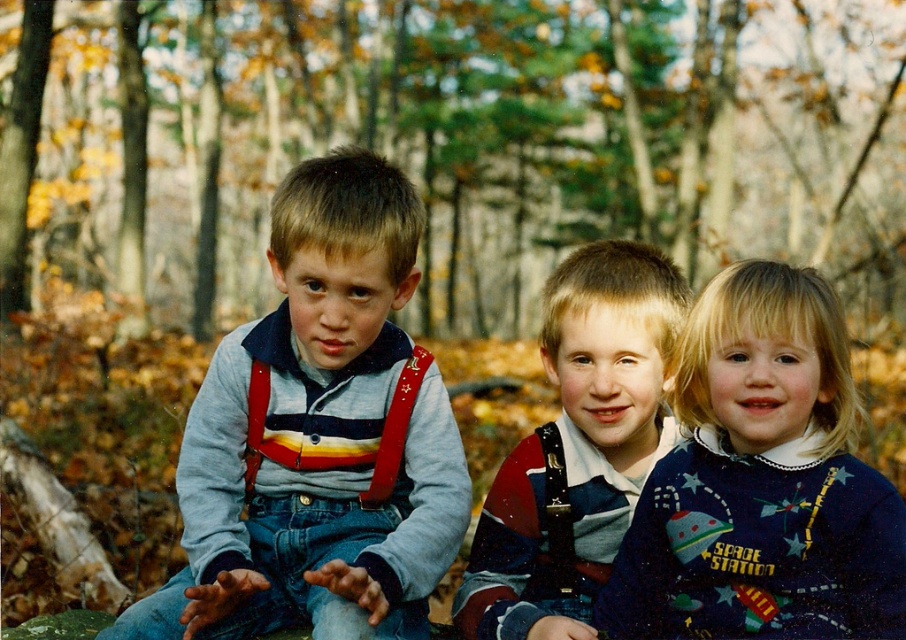
You are a photographer wanting to capture a clear shot of both the matte gray sweater at center and the matte striped shirt at center. Since you can only focus on one object at a time, which one should you choose to ensure the other is still somewhat in focus?

You should focus on the matte gray sweater at center because it is closer to the viewer than the matte striped shirt at center. By focusing on the closer object, the farther one will still be somewhat in focus due to the depth of field.